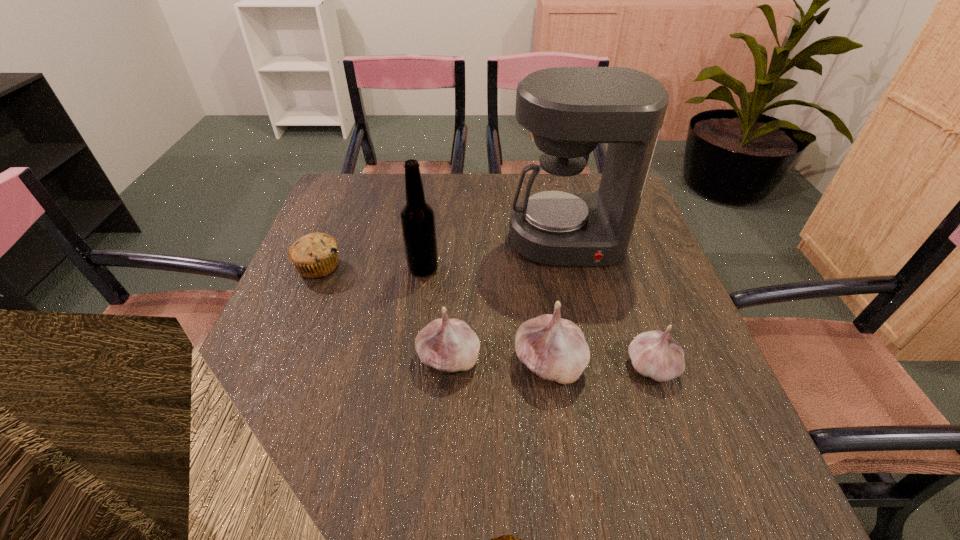
This screenshot has width=960, height=540. In order to click on empty space that is in between the shortest garlic and the tallest object in this screenshot , I will do `click(610, 303)`.

This screenshot has height=540, width=960. In order to click on free space between the second garlic from left to right and the second shortest garlic in this screenshot , I will do click(x=499, y=361).

Locate which object is the fifth closest to the shortest garlic. Please provide its 2D coordinates. Your answer should be formatted as a tuple, i.e. [(x, y)], where the tuple contains the x and y coordinates of a point satisfying the conditions above.

[(315, 255)]

The width and height of the screenshot is (960, 540). I want to click on the third closest object to the shortest garlic, so click(449, 345).

This screenshot has width=960, height=540. I want to click on garlic that is the second nearest to the third shortest object, so click(x=655, y=354).

This screenshot has width=960, height=540. I want to click on garlic that stands as the second closest to the beer bottle, so click(x=555, y=349).

Find the location of a particular element. The image size is (960, 540). vacant space that satisfies the following two spatial constraints: 1. on the button side of the shortest garlic; 2. on the left side of the coffee maker is located at coordinates (596, 366).

This screenshot has width=960, height=540. What are the coordinates of `vacant space that satisfies the following two spatial constraints: 1. on the front side of the shortest object; 2. on the right side of the rightmost garlic` in the screenshot? It's located at (279, 366).

The image size is (960, 540). In order to click on vacant space that satisfies the following two spatial constraints: 1. on the button side of the second shortest object; 2. on the left side of the coffee maker in this screenshot , I will do `click(596, 366)`.

Image resolution: width=960 pixels, height=540 pixels. In order to click on free spot that satisfies the following two spatial constraints: 1. on the front side of the rightmost garlic; 2. on the right side of the second garlic from right to left in this screenshot , I will do `click(550, 366)`.